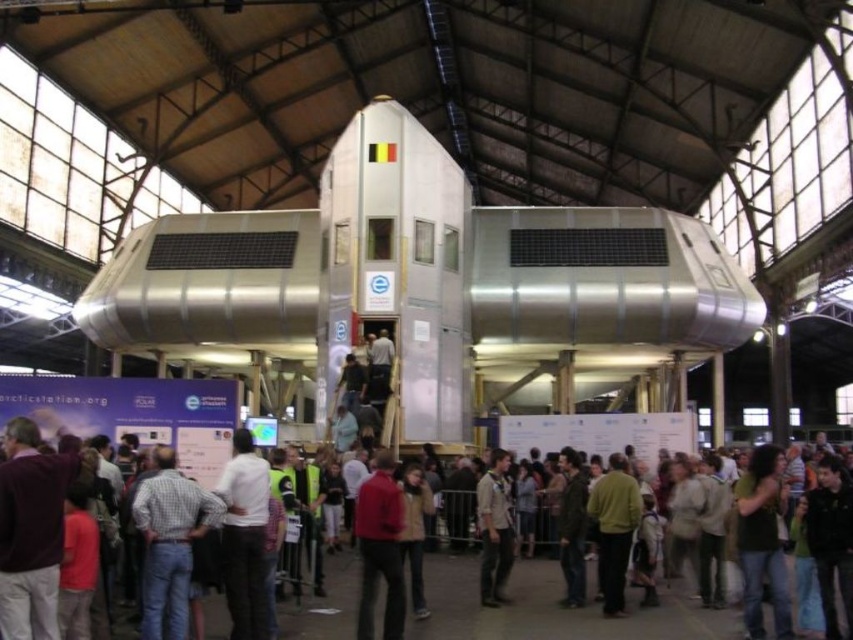
You are standing in the exhibition hall and want to take a photo of the model building. The camera you are using has a maximum focus range of 120 feet. Will the point at point (x=12, y=605) be within the camera focus range?

The point at point (x=12, y=605) is 122.22 feet from the camera, which exceeds the maximum focus range of 120 feet. Therefore, the camera cannot focus on that point.

You are a security guard in the exhibition hall and need to determine which item is shorter between the jeans at center and the light brown leather jacket at center. Which one should you report?

The jeans at center has a lesser height compared to the light brown leather jacket at center, so you should report that the jeans at center is shorter.